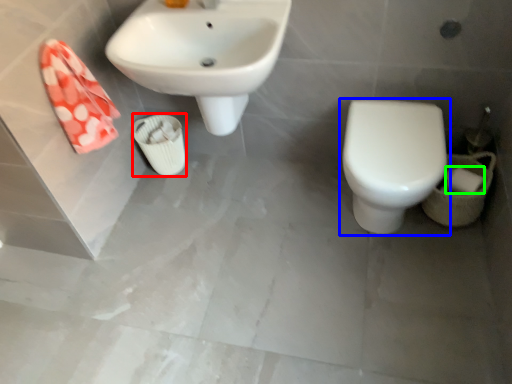
Question: Which is farther away from porcelain (highlighted by a red box)? toilet (highlighted by a blue box) or toilet paper (highlighted by a green box)?

Choices:
 (A) toilet
 (B) toilet paper

Answer: (B)